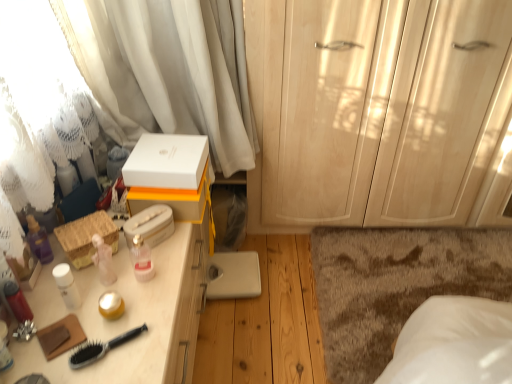
In order to click on vacant space to the right of woven straw basket at left, the 3th storage box viewed from the top in this screenshot , I will do `click(140, 268)`.